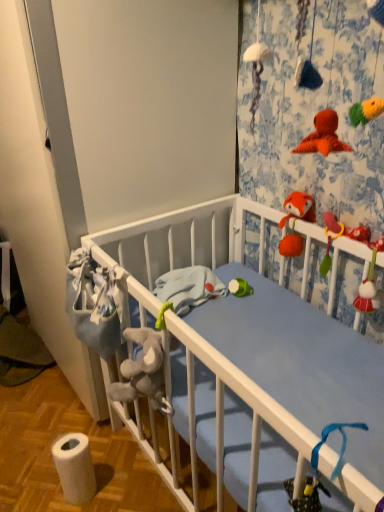
Question: From a real-world perspective, is white matte toilet paper at lower left beneath fluffy orange fox at upper right?

Choices:
 (A) no
 (B) yes

Answer: (B)

Question: From a real-world perspective, is white matte toilet paper at lower left on fluffy orange fox at upper right?

Choices:
 (A) no
 (B) yes

Answer: (A)

Question: Is white matte toilet paper at lower left looking in the opposite direction of fluffy orange fox at upper right?

Choices:
 (A) yes
 (B) no

Answer: (B)

Question: Is fluffy orange fox at upper right inside white matte toilet paper at lower left?

Choices:
 (A) no
 (B) yes

Answer: (A)

Question: Does white matte toilet paper at lower left have a larger size compared to fluffy orange fox at upper right?

Choices:
 (A) yes
 (B) no

Answer: (A)

Question: Is white matte toilet paper at lower left at the left side of fluffy orange fox at upper right?

Choices:
 (A) no
 (B) yes

Answer: (B)

Question: Is fluffy orange fox at upper right bigger than white matte toilet paper at lower left?

Choices:
 (A) no
 (B) yes

Answer: (A)

Question: Is fluffy orange fox at upper right completely or partially outside of white matte toilet paper at lower left?

Choices:
 (A) no
 (B) yes

Answer: (B)

Question: Is fluffy orange fox at upper right behind white matte toilet paper at lower left?

Choices:
 (A) no
 (B) yes

Answer: (B)

Question: Is fluffy orange fox at upper right facing towards white matte toilet paper at lower left?

Choices:
 (A) no
 (B) yes

Answer: (A)

Question: From the image's perspective, would you say fluffy orange fox at upper right is positioned over white matte toilet paper at lower left?

Choices:
 (A) no
 (B) yes

Answer: (B)

Question: Would you say fluffy orange fox at upper right is a long distance from white matte toilet paper at lower left?

Choices:
 (A) no
 (B) yes

Answer: (A)

Question: From a real-world perspective, is white matte toilet paper at lower left above or below fluffy orange fox at upper right?

Choices:
 (A) below
 (B) above

Answer: (A)